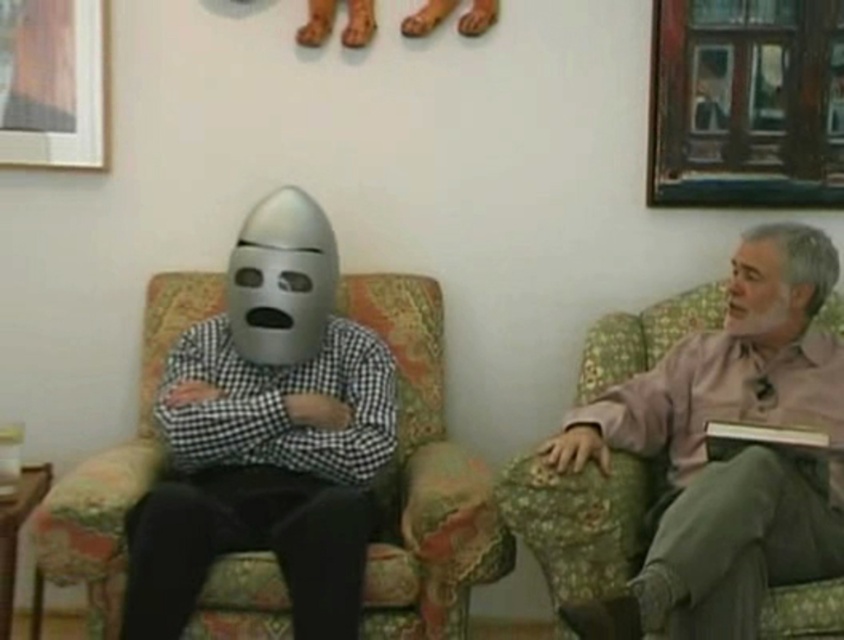
Question: Does floral fabric armchair at right have a greater width compared to brushed metal picture frame at upper left?

Choices:
 (A) yes
 (B) no

Answer: (A)

Question: Is the position of patterned fabric armchair at center less distant than that of wooden framed picture at upper right?

Choices:
 (A) yes
 (B) no

Answer: (A)

Question: Which of the following is the closest to the observer?

Choices:
 (A) wooden framed picture at upper right
 (B) patterned fabric armchair at center

Answer: (B)

Question: Is wooden framed picture at upper right further to the viewer compared to brushed metal picture frame at upper left?

Choices:
 (A) no
 (B) yes

Answer: (B)

Question: Which object is positioned farthest from the patterned fabric armchair at center?

Choices:
 (A) floral fabric armchair at right
 (B) brushed metal picture frame at upper left

Answer: (B)

Question: Which is farther from the patterned fabric armchair at center?

Choices:
 (A) floral fabric armchair at right
 (B) wooden framed picture at upper right
 (C) brushed metal picture frame at upper left

Answer: (C)